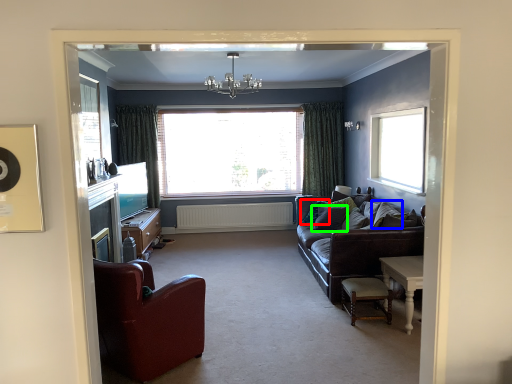
Question: Considering the real-world distances, which object is farthest from pillow (highlighted by a red box)? pillow (highlighted by a blue box) or pillow (highlighted by a green box)?

Choices:
 (A) pillow
 (B) pillow

Answer: (A)